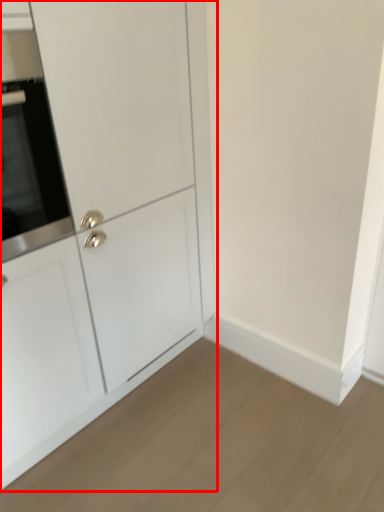
Question: From the image's perspective, what is the correct spatial relationship of cabinetry (annotated by the red box) in relation to oven?

Choices:
 (A) above
 (B) below

Answer: (B)